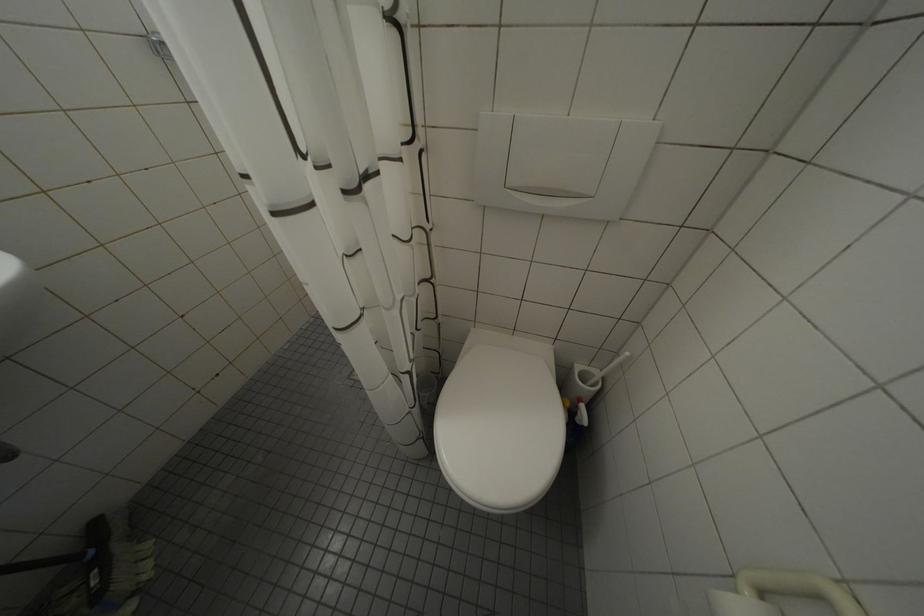
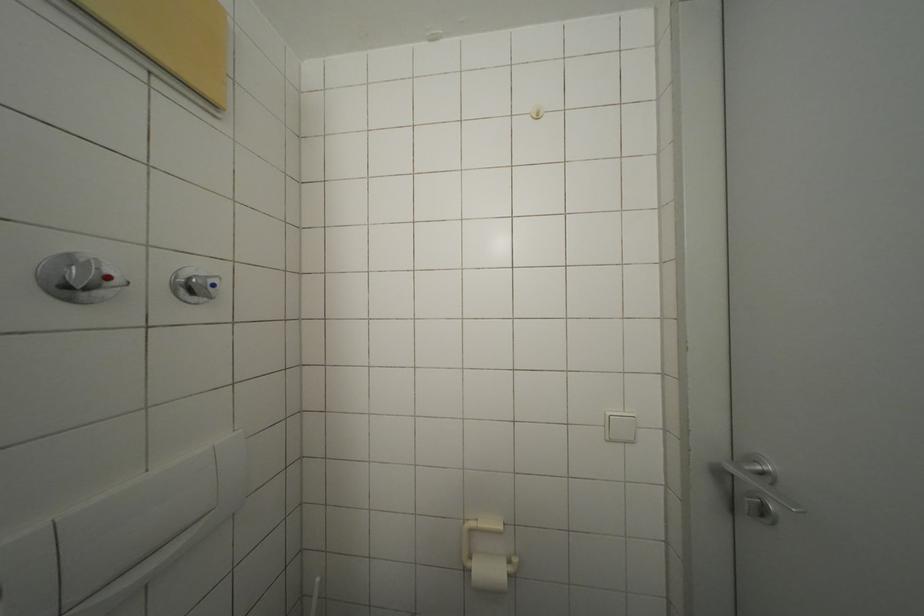
Question: How did the camera likely rotate?

Choices:
 (A) Left
 (B) Right
 (C) Up
 (D) Down

Answer: (B)